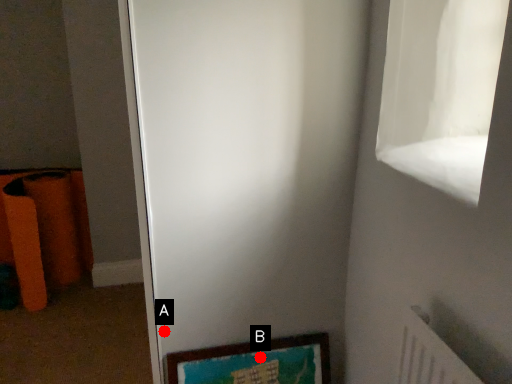
Question: Two points are circled on the image, labeled by A and B beside each circle. Which point is closer to the camera taking this photo?

Choices:
 (A) A is closer
 (B) B is closer

Answer: (A)